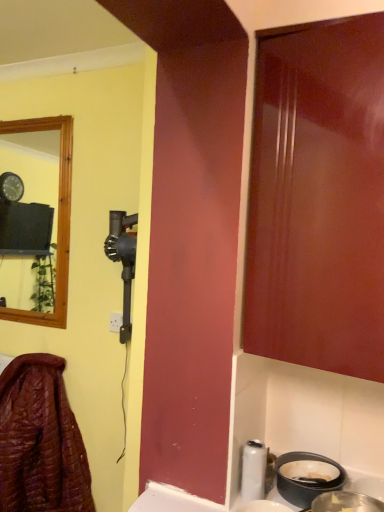
Question: Would you say leather jacket at lower left is part of metallic silver basin at lower right's contents?

Choices:
 (A) yes
 (B) no

Answer: (B)

Question: Is metallic silver basin at lower right turned away from leather jacket at lower left?

Choices:
 (A) yes
 (B) no

Answer: (B)

Question: From a real-world perspective, does metallic silver basin at lower right sit lower than leather jacket at lower left?

Choices:
 (A) yes
 (B) no

Answer: (B)

Question: Does metallic silver basin at lower right have a lesser width compared to leather jacket at lower left?

Choices:
 (A) no
 (B) yes

Answer: (B)

Question: From the image's perspective, is metallic silver basin at lower right above leather jacket at lower left?

Choices:
 (A) no
 (B) yes

Answer: (B)

Question: Is metallic silver basin at lower right placed right next to leather jacket at lower left?

Choices:
 (A) no
 (B) yes

Answer: (A)

Question: Does leather jacket at lower left have a smaller size compared to metallic silver basin at lower right?

Choices:
 (A) no
 (B) yes

Answer: (A)

Question: Is leather jacket at lower left taller than metallic silver basin at lower right?

Choices:
 (A) no
 (B) yes

Answer: (B)

Question: Considering the relative sizes of leather jacket at lower left and metallic silver basin at lower right in the image provided, is leather jacket at lower left shorter than metallic silver basin at lower right?

Choices:
 (A) no
 (B) yes

Answer: (A)

Question: Can you confirm if leather jacket at lower left is bigger than metallic silver basin at lower right?

Choices:
 (A) yes
 (B) no

Answer: (A)

Question: From the image's perspective, is leather jacket at lower left located beneath metallic silver basin at lower right?

Choices:
 (A) no
 (B) yes

Answer: (B)

Question: Are leather jacket at lower left and metallic silver basin at lower right far apart?

Choices:
 (A) no
 (B) yes

Answer: (B)

Question: Considering their positions, is metallic silver basin at lower right located in front of or behind leather jacket at lower left?

Choices:
 (A) front
 (B) behind

Answer: (A)